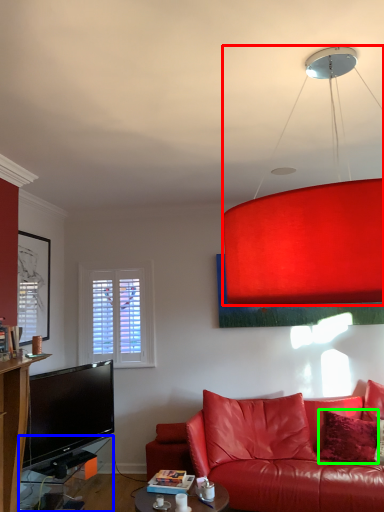
Question: Estimate the real-world distances between objects in this image. Which object is closer to lamp (highlighted by a red box), table (highlighted by a blue box) or pillow (highlighted by a green box)?

Choices:
 (A) table
 (B) pillow

Answer: (A)